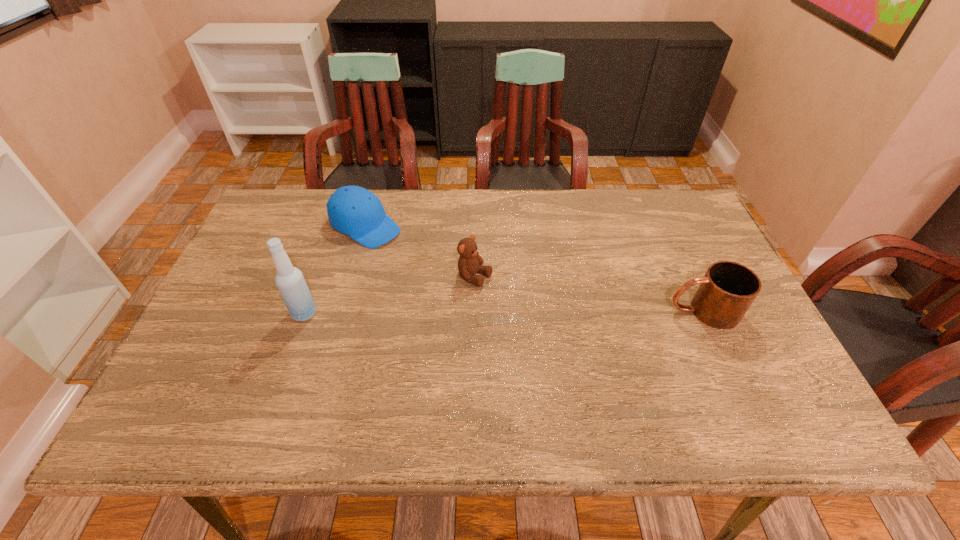
The height and width of the screenshot is (540, 960). What are the coordinates of `free spot on the desktop that is between the bottle and the mug and is positioned on the front-facing side of the farthest object` in the screenshot? It's located at (503, 312).

Identify the location of vacant spot on the desktop that is between the bottle and the mug and is positioned on the face of the second farthest object. Image resolution: width=960 pixels, height=540 pixels. (547, 312).